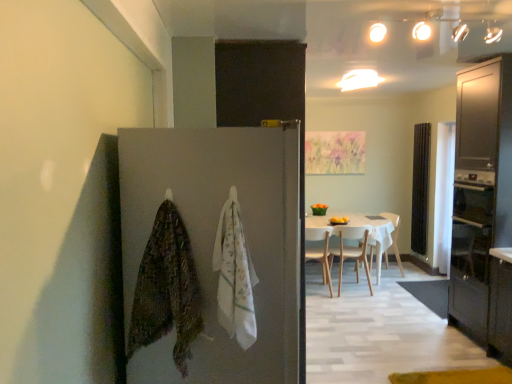
Describe the element at coordinates (234, 275) in the screenshot. The height and width of the screenshot is (384, 512). I see `white cotton towel at center, arranged as the 2th blanket when viewed from the left` at that location.

Where is `black glass oven at right`? The image size is (512, 384). black glass oven at right is located at coordinates (472, 229).

Describe the element at coordinates (420, 187) in the screenshot. The height and width of the screenshot is (384, 512). I see `black wood screen door at right` at that location.

Image resolution: width=512 pixels, height=384 pixels. I want to click on white glossy light fixture at upper center, so click(359, 79).

How much space does textured multicolored blanket at left, placed as the first blanket when sorted from left to right, occupy vertically?

textured multicolored blanket at left, placed as the first blanket when sorted from left to right, is 25.06 inches in height.

Describe the element at coordinates (395, 236) in the screenshot. I see `white wood chair at center, the third chair when ordered from left to right` at that location.

Measure the distance between white wood chair at center, the 1th chair positioned from the right, and camera.

white wood chair at center, the 1th chair positioned from the right, and camera are 18.50 feet apart from each other.

Locate an element on the screen. white cotton towel at center, the 1th blanket in the right-to-left sequence is located at coordinates (234, 275).

In terms of size, does white wood chair at center, the 1th chair positioned from the right, appear bigger or smaller than black wood screen door at right?

Considering their sizes, white wood chair at center, the 1th chair positioned from the right, takes up more space than black wood screen door at right.

Looking at their sizes, would you say white wood chair at center, the 1th chair positioned from the right, is wider or thinner than black wood screen door at right?

white wood chair at center, the 1th chair positioned from the right, is wider than black wood screen door at right.

Does white wood chair at center, the 1th chair positioned from the right, lie behind black wood screen door at right?

No.

You are a GUI agent. You are given a task and a screenshot of the screen. Output one action in this format:
    pyautogui.click(x=<x>, y=<y>)
    Task: Click on the screen door to the right of white wood chair at center, the third chair when ordered from left to right
    The height and width of the screenshot is (384, 512).
    Given the screenshot: What is the action you would take?
    pyautogui.click(x=420, y=187)

Is wooden chair at center, which is counted as the first chair, starting from the left, positioned with its back to white glossy light fixture at upper center?

No, wooden chair at center, which is counted as the first chair, starting from the left,'s orientation is not away from white glossy light fixture at upper center.

Is wooden chair at center, which appears as the third chair when viewed from the right, next to white glossy light fixture at upper center?

No, wooden chair at center, which appears as the third chair when viewed from the right, is not beside white glossy light fixture at upper center.

Between wooden chair at center, which appears as the third chair when viewed from the right, and white glossy light fixture at upper center, which one has smaller size?

Smaller between the two is white glossy light fixture at upper center.

In the scene shown: Is black glass oven at right positioned before black wood screen door at right?

Yes, black glass oven at right is closer to the camera.

Considering the relative sizes of black glass oven at right and black wood screen door at right in the image provided, is black glass oven at right smaller than black wood screen door at right?

Actually, black glass oven at right might be larger than black wood screen door at right.

The height and width of the screenshot is (384, 512). In order to click on appliance below the black wood screen door at right (from the image's perspective) in this screenshot , I will do tap(472, 229).

From the image's perspective, is black glass oven at right on top of black wood screen door at right?

No, from the image's perspective, black glass oven at right is not over black wood screen door at right.

Considering the sizes of black glass oven at right and white glossy table at center in the image, is black glass oven at right taller or shorter than white glossy table at center?

Clearly, black glass oven at right is taller compared to white glossy table at center.

Which of these two, black glass oven at right or white glossy table at center, is wider?

With larger width is white glossy table at center.

From a real-world perspective, is black glass oven at right physically located above or below white glossy table at center?

Clearly, from a real-world perspective, black glass oven at right is above white glossy table at center.

Where is `kitchen & dining room table behind the black glass oven at right`? This screenshot has width=512, height=384. kitchen & dining room table behind the black glass oven at right is located at coordinates (365, 227).

Based on their sizes in the image, would you say black wood screen door at right is bigger or smaller than white cotton towel at center, the 1th blanket in the right-to-left sequence?

black wood screen door at right is bigger than white cotton towel at center, the 1th blanket in the right-to-left sequence.

Consider the image. Does black wood screen door at right have a lesser height compared to white cotton towel at center, the 1th blanket in the right-to-left sequence?

No.

Does point (417, 230) appear closer or farther from the camera than point (216, 258)?

Point (417, 230) is positioned farther from the camera compared to point (216, 258).

Locate an element on the screen. The height and width of the screenshot is (384, 512). the 1st blanket to the left when counting from the black wood screen door at right is located at coordinates pos(234,275).

Is the surface of matte gray door at center in direct contact with black wood screen door at right?

No, matte gray door at center is not making contact with black wood screen door at right.

From a real-world perspective, relative to black wood screen door at right, is matte gray door at center vertically above or below?

Clearly, from a real-world perspective, matte gray door at center is below black wood screen door at right.

How different are the orientations of matte gray door at center and black wood screen door at right in degrees?

They differ by 180 degrees in their facing directions.

In the image, is matte gray door at center on the left side or the right side of black wood screen door at right?

In the image, matte gray door at center appears on the left side of black wood screen door at right.

Considering the relative positions of matte dark wood cabinet at right and wooden chair at center, which appears as the third chair when viewed from the right, in the image provided, is matte dark wood cabinet at right behind wooden chair at center, which appears as the third chair when viewed from the right,?

No, matte dark wood cabinet at right is closer to the camera.

Are matte dark wood cabinet at right and wooden chair at center, which appears as the third chair when viewed from the right, located far from each other?

matte dark wood cabinet at right is far away from wooden chair at center, which appears as the third chair when viewed from the right.

Does matte dark wood cabinet at right have a lesser width compared to wooden chair at center, which is counted as the first chair, starting from the left?

In fact, matte dark wood cabinet at right might be wider than wooden chair at center, which is counted as the first chair, starting from the left.

Does matte dark wood cabinet at right appear on the left side of wooden chair at center, which is counted as the first chair, starting from the left?

In fact, matte dark wood cabinet at right is to the right of wooden chair at center, which is counted as the first chair, starting from the left.

Locate an element on the screen. The image size is (512, 384). screen door above the white wood chair at center, the 1th chair positioned from the right (from a real-world perspective) is located at coordinates (420, 187).

What are the coordinates of `lighting in front of the wooden chair at center, which appears as the third chair when viewed from the right` in the screenshot? It's located at (359, 79).

Which object lies nearer to the anchor point wooden chair at center, which is counted as the first chair, starting from the left, white glossy light fixture at upper center or white wood chair at center, placed as the second chair when sorted from right to left?

white wood chair at center, placed as the second chair when sorted from right to left, is positioned closer to the anchor wooden chair at center, which is counted as the first chair, starting from the left.

When comparing their distances from black glass oven at right, does white cotton towel at center, the 1th blanket in the right-to-left sequence, or white glossy table at center seem further?

white cotton towel at center, the 1th blanket in the right-to-left sequence, is further to black glass oven at right.

Estimate the real-world distances between objects in this image. Which object is closer to white glossy light fixture at upper center, white glossy table at center or black wood screen door at right?

Among the two, white glossy table at center is located nearer to white glossy light fixture at upper center.

Which object lies nearer to the anchor point black glass oven at right, matte dark wood cabinet at right or textured multicolored blanket at left, marked as the 2th blanket in a right-to-left arrangement?

matte dark wood cabinet at right lies closer to black glass oven at right than the other object.

Considering their positions, is white cotton towel at center, the 1th blanket in the right-to-left sequence, positioned closer to matte dark wood cabinet at right than textured multicolored blanket at left, marked as the 2th blanket in a right-to-left arrangement?

white cotton towel at center, the 1th blanket in the right-to-left sequence, lies closer to matte dark wood cabinet at right than the other object.

Considering their positions, is matte gray door at center positioned further to white wood chair at center, the 1th chair positioned from the right, than black wood screen door at right?

matte gray door at center is further to white wood chair at center, the 1th chair positioned from the right.

Considering their positions, is black wood screen door at right positioned further to textured multicolored blanket at left, placed as the first blanket when sorted from left to right, than matte gray door at center?

black wood screen door at right.

Estimate the real-world distances between objects in this image. Which object is closer to white glossy table at center, textured multicolored blanket at left, placed as the first blanket when sorted from left to right, or black wood screen door at right?

The object closer to white glossy table at center is black wood screen door at right.

Image resolution: width=512 pixels, height=384 pixels. I want to click on appliance located between white cotton towel at center, arranged as the 2th blanket when viewed from the left, and white wood chair at center, the 2th chair positioned from the left, in the depth direction, so click(472, 229).

Identify the location of appliance between white glossy light fixture at upper center and wooden chair at center, which appears as the third chair when viewed from the right, vertically. This screenshot has height=384, width=512. (472, 229).

In order to click on door between white cotton towel at center, the 1th blanket in the right-to-left sequence, and white wood chair at center, the 2th chair positioned from the left, from front to back in this screenshot , I will do `click(214, 242)`.

The height and width of the screenshot is (384, 512). Identify the location of door between white cotton towel at center, arranged as the 2th blanket when viewed from the left, and black wood screen door at right from front to back. (214, 242).